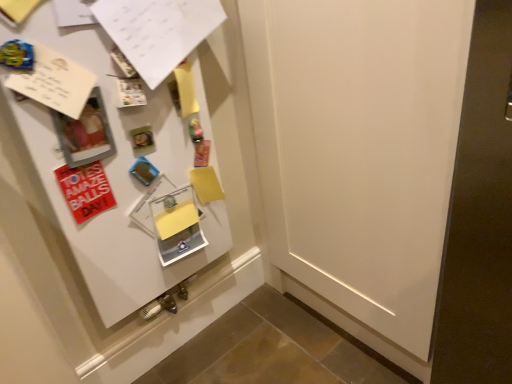
Describe the element at coordinates (157, 31) in the screenshot. The width and height of the screenshot is (512, 384). I see `white paper at upper left` at that location.

Where is `white paper at upper left`? This screenshot has height=384, width=512. white paper at upper left is located at coordinates (157, 31).

Describe the element at coordinates (85, 190) in the screenshot. I see `red matte postcard at left` at that location.

In order to face red matte postcard at left, should I rotate leftwards or rightwards?

You should look left and rotate roughly 21.026 degrees.

The width and height of the screenshot is (512, 384). Identify the location of red matte postcard at left. (85, 190).

This screenshot has height=384, width=512. What are the coordinates of `white paper at upper left` in the screenshot? It's located at (157, 31).

Considering the relative positions of red matte postcard at left and white paper at upper left in the image provided, is red matte postcard at left to the right of white paper at upper left from the viewer's perspective?

Incorrect, red matte postcard at left is not on the right side of white paper at upper left.

Is red matte postcard at left in front of white paper at upper left?

No, it is behind white paper at upper left.

Which is in front, point (91, 164) or point (157, 55)?

The point (91, 164) is closer.

From the image's perspective, which one is positioned lower, red matte postcard at left or white paper at upper left?

red matte postcard at left.

From a real-world perspective, is red matte postcard at left physically below white paper at upper left?

Indeed, from a real-world perspective, red matte postcard at left is positioned beneath white paper at upper left.

Which object is thinner, red matte postcard at left or white paper at upper left?

Thinner between the two is red matte postcard at left.

Considering the sizes of objects red matte postcard at left and white paper at upper left in the image provided, who is shorter, red matte postcard at left or white paper at upper left?

Standing shorter between the two is red matte postcard at left.

Consider the image. Considering the sizes of objects red matte postcard at left and white paper at upper left in the image provided, who is smaller, red matte postcard at left or white paper at upper left?

With smaller size is red matte postcard at left.

Is red matte postcard at left positioned beyond the bounds of white paper at upper left?

Yes, red matte postcard at left is not within white paper at upper left.

Is red matte postcard at left next to white paper at upper left and touching it?

red matte postcard at left is not next to white paper at upper left, and they're not touching.

Is red matte postcard at left looking in the opposite direction of white paper at upper left?

No, red matte postcard at left is not facing away from white paper at upper left.

How many degrees apart are the facing directions of red matte postcard at left and white paper at upper left?

red matte postcard at left and white paper at upper left are facing 6.99 degrees away from each other.

In order to click on postcard that appears behind the white paper at upper left in this screenshot , I will do `click(85, 190)`.

Can you confirm if white paper at upper left is positioned to the left of red matte postcard at left?

In fact, white paper at upper left is to the right of red matte postcard at left.

Considering the relative positions of white paper at upper left and red matte postcard at left in the image provided, is white paper at upper left behind red matte postcard at left?

No, it is in front of red matte postcard at left.

Which is closer to the camera, [131,48] or [56,175]?

Clearly, point [131,48] is closer to the camera than point [56,175].

Consider the image. From the image's perspective, which is below, white paper at upper left or red matte postcard at left?

From the image's view, red matte postcard at left is below.

From a real-world perspective, which object stands above the other?

From a 3D spatial view, white paper at upper left is above.

Which object is thinner, white paper at upper left or red matte postcard at left?

Thinner between the two is red matte postcard at left.

Is white paper at upper left shorter than red matte postcard at left?

In fact, white paper at upper left may be taller than red matte postcard at left.

Who is smaller, white paper at upper left or red matte postcard at left?

Smaller between the two is red matte postcard at left.

Is red matte postcard at left located within white paper at upper left?

No, red matte postcard at left is located outside of white paper at upper left.

Is white paper at upper left not near red matte postcard at left?

No.

Is white paper at upper left positioned with its back to red matte postcard at left?

No.

Find the location of a particular element. The width and height of the screenshot is (512, 384). postcard below the white paper at upper left (from the image's perspective) is located at coordinates (85, 190).

Where is `postcard below the white paper at upper left (from a real-world perspective)`? The image size is (512, 384). postcard below the white paper at upper left (from a real-world perspective) is located at coordinates coord(85,190).

What are the coordinates of `paper on the right of red matte postcard at left` in the screenshot? It's located at 157,31.